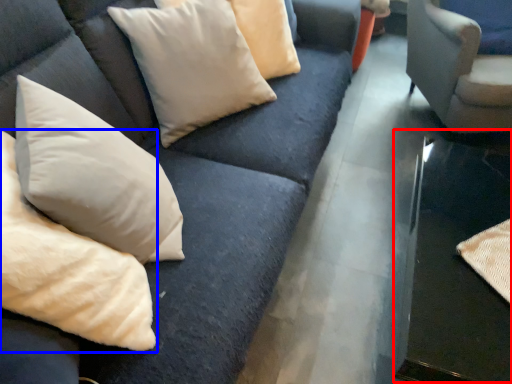
Question: Which point is further to the camera, table (highlighted by a red box) or pillow (highlighted by a blue box)?

Choices:
 (A) table
 (B) pillow

Answer: (A)